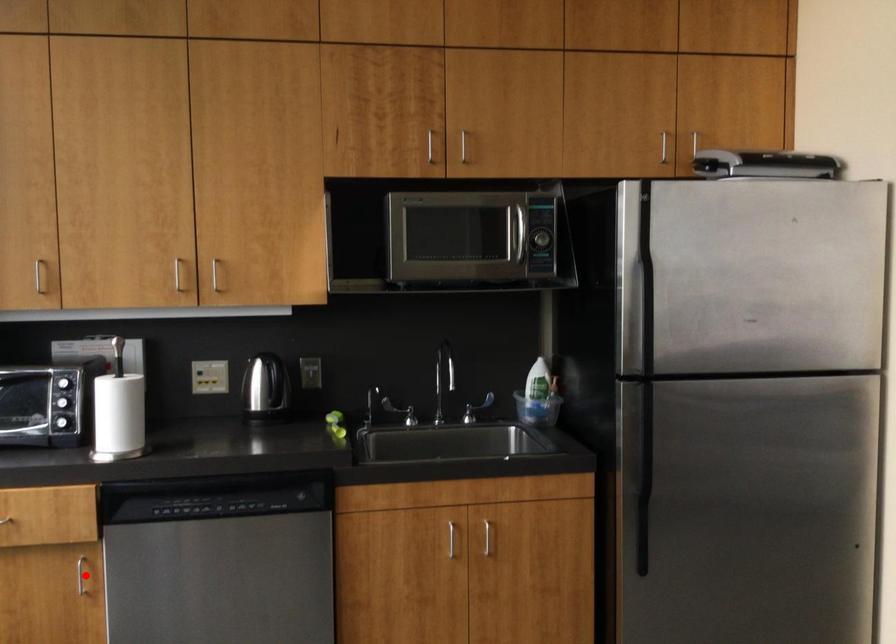
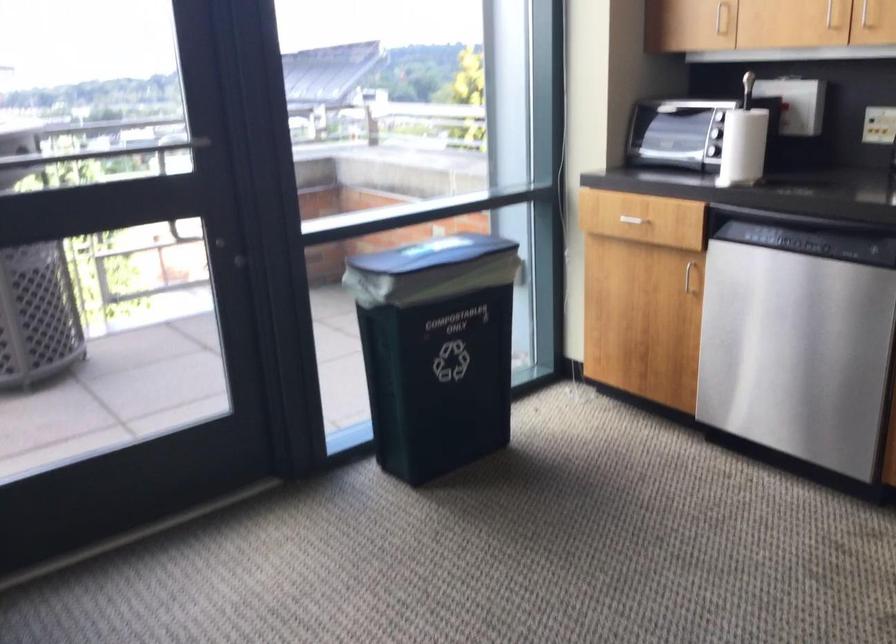
Locate, in the second image, the point that corresponds to the highlighted location in the first image.

(690, 276)